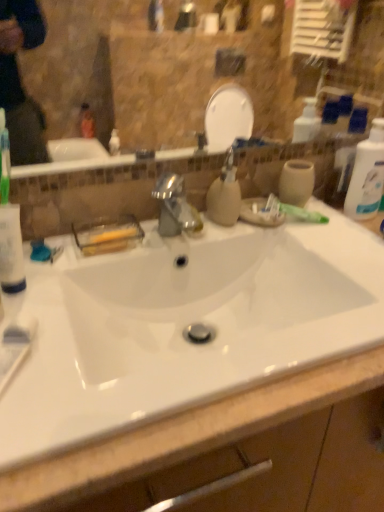
Question: From the image's perspective, is white plastic bottle at right located above or below white glossy sink at center?

Choices:
 (A) above
 (B) below

Answer: (A)

Question: In terms of size, does white plastic bottle at right appear bigger or smaller than white glossy sink at center?

Choices:
 (A) small
 (B) big

Answer: (A)

Question: Which object is positioned farthest from the white glossy sink at center?

Choices:
 (A) matte beige soap dispenser at center
 (B) white plastic bottle at right
 (C) green matte toothpaste at upper right

Answer: (B)

Question: Which is nearer to the green matte toothpaste at upper right?

Choices:
 (A) white glossy sink at center
 (B) matte beige soap dispenser at center
 (C) white plastic bottle at right

Answer: (B)